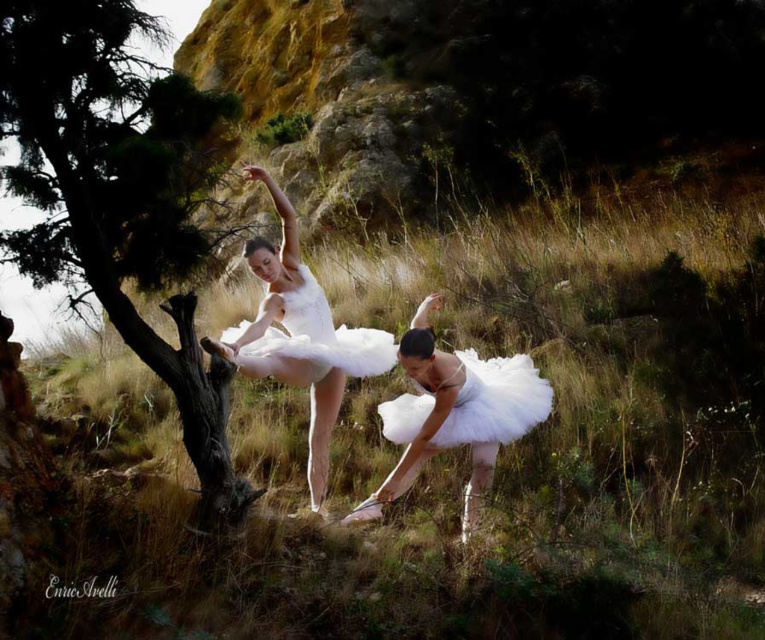
Question: Estimate the real-world distances between objects in this image. Which object is farther from the white tulle dress at center?

Choices:
 (A) white tulle tutu at lower center
 (B) green textured tree at left
 (C) white tulle tutu at center
 (D) white satin tutu at center

Answer: (B)

Question: Which object is farther from the camera taking this photo?

Choices:
 (A) white tulle tutu at center
 (B) white tulle dress at center

Answer: (B)

Question: Does white tulle tutu at center lie behind white tulle dress at center?

Choices:
 (A) yes
 (B) no

Answer: (B)

Question: Is white satin tutu at center bigger than white tulle dress at center?

Choices:
 (A) yes
 (B) no

Answer: (A)

Question: Is white tulle tutu at center above white satin tutu at center?

Choices:
 (A) no
 (B) yes

Answer: (A)

Question: Which object is the closest to the white satin tutu at center?

Choices:
 (A) white tulle tutu at center
 (B) green textured tree at left
 (C) white tulle dress at center

Answer: (C)